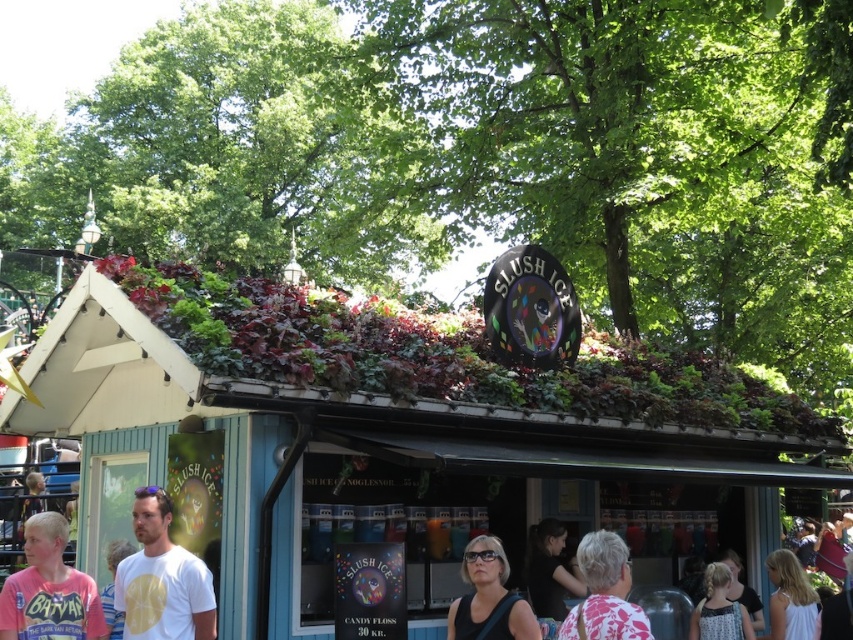
Is floral-patterned shirt at center to the left of black fabric at center from the viewer's perspective?

In fact, floral-patterned shirt at center is to the right of black fabric at center.

Is floral-patterned shirt at center positioned before black fabric at center?

Yes.

Is point (630, 580) closer to camera compared to point (466, 573)?

Yes.

In order to click on floral-patterned shirt at center in this screenshot , I will do `click(604, 593)`.

Is white matte t-shirt at lower left shorter than pink cotton shirt at lower left?

In fact, white matte t-shirt at lower left may be taller than pink cotton shirt at lower left.

Is point (137, 570) positioned in front of point (44, 602)?

No, it is behind (44, 602).

This screenshot has height=640, width=853. I want to click on white matte t-shirt at lower left, so click(x=161, y=579).

Describe the element at coordinates (161, 579) in the screenshot. I see `white matte t-shirt at lower left` at that location.

Is white matte t-shirt at lower left positioned at the back of black fabric at center?

Yes.

Describe the element at coordinates (161, 579) in the screenshot. I see `white matte t-shirt at lower left` at that location.

What are the coordinates of `white matte t-shirt at lower left` in the screenshot? It's located at (161, 579).